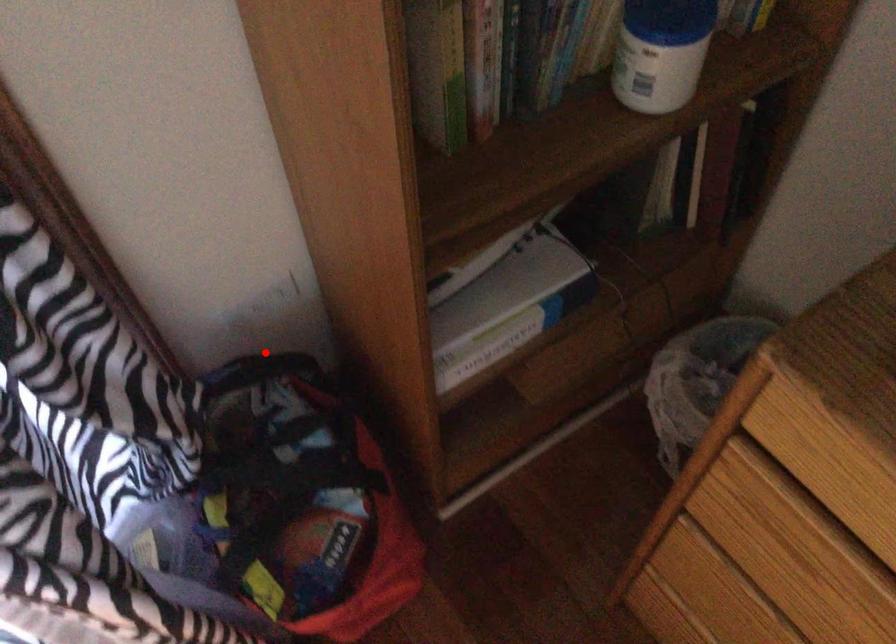
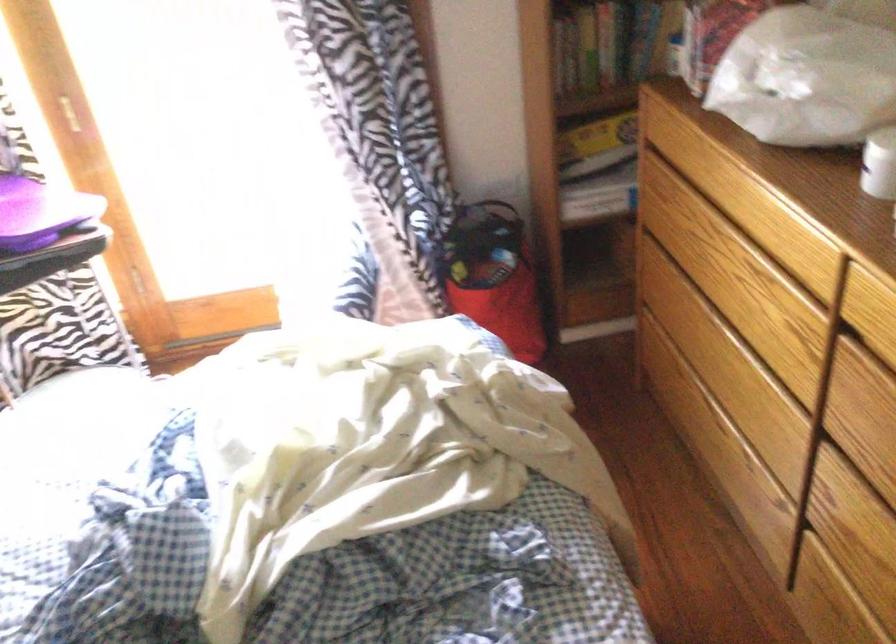
In the second image, find the point that corresponds to the highlighted location in the first image.

(493, 200)